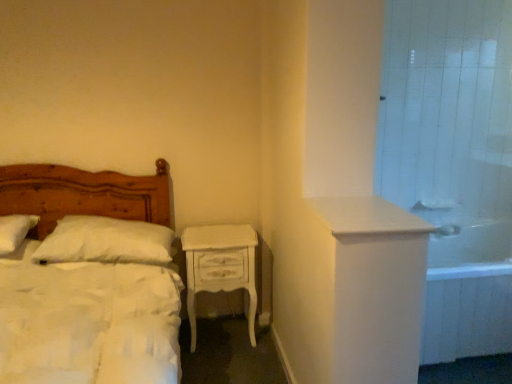
This screenshot has width=512, height=384. Find the location of `white tile shower door at upper right`. white tile shower door at upper right is located at coordinates (453, 162).

Describe the element at coordinates (106, 241) in the screenshot. The height and width of the screenshot is (384, 512). I see `white soft pillow at left, the second pillow viewed from the left` at that location.

In order to face white soft pillow at left, which appears as the 2th pillow when viewed from the right, should I rotate leftwards or rightwards?

To align with it, rotate left about 30.314°.

In order to face white painted wood nightstand at center, should I rotate leftwards or rightwards?

You should rotate left by 4.988 degrees.

Measure the distance between white glossy sink at upper right and camera.

A distance of 2.83 meters exists between white glossy sink at upper right and camera.

At what (x,y) coordinates should I click in order to perform the action: click on white tile shower door at upper right. Please return your answer as a coordinate pair (x, y). Looking at the image, I should click on (453, 162).

Does white soft pillow at left, which appears as the 2th pillow when viewed from the right, have a lesser height compared to white tile shower door at upper right?

Indeed, white soft pillow at left, which appears as the 2th pillow when viewed from the right, has a lesser height compared to white tile shower door at upper right.

Which of these two, white soft pillow at left, which is counted as the first pillow, starting from the left, or white tile shower door at upper right, is bigger?

With larger size is white tile shower door at upper right.

Is white soft pillow at left, the second pillow viewed from the left, located outside wooden bed at left?

Actually, white soft pillow at left, the second pillow viewed from the left, is at least partially inside wooden bed at left.

Which is behind, white soft pillow at left, the 1th pillow when ordered from right to left, or wooden bed at left?

white soft pillow at left, the 1th pillow when ordered from right to left, is more distant.

Considering the positions of points (103, 226) and (89, 263), is point (103, 226) farther from camera compared to point (89, 263)?

Yes, point (103, 226) is behind point (89, 263).

How different are the orientations of white soft pillow at left, the 1th pillow when ordered from right to left, and wooden bed at left in degrees?

The facing directions of white soft pillow at left, the 1th pillow when ordered from right to left, and wooden bed at left are 2.78 degrees apart.

From the image's perspective, is white soft pillow at left, which appears as the 2th pillow when viewed from the right, located beneath wooden bed at left?

Incorrect, from the image's perspective, white soft pillow at left, which appears as the 2th pillow when viewed from the right, is higher than wooden bed at left.

Which object is positioned more to the left, white soft pillow at left, which appears as the 2th pillow when viewed from the right, or wooden bed at left?

Positioned to the left is white soft pillow at left, which appears as the 2th pillow when viewed from the right.

Is there a large distance between white soft pillow at left, which is counted as the first pillow, starting from the left, and wooden bed at left?

white soft pillow at left, which is counted as the first pillow, starting from the left, is near wooden bed at left, not far away.

Between white soft pillow at left, which is counted as the first pillow, starting from the left, and wooden bed at left, which one has smaller size?

white soft pillow at left, which is counted as the first pillow, starting from the left.

Is white tile shower door at upper right positioned far away from white painted wood nightstand at center?

Yes, white tile shower door at upper right is far from white painted wood nightstand at center.

Is white tile shower door at upper right surrounding white painted wood nightstand at center?

Definitely not — white painted wood nightstand at center is not inside white tile shower door at upper right.

From the picture: From the image's perspective, which is above, white tile shower door at upper right or white painted wood nightstand at center?

Answer: white tile shower door at upper right, from the image's perspective.

Looking at the image, does white tile shower door at upper right seem bigger or smaller compared to white painted wood nightstand at center?

Clearly, white tile shower door at upper right is smaller in size than white painted wood nightstand at center.

Is white glossy sink at upper right to the left of white glossy bathtub at right from the viewer's perspective?

Yes.

Does point (415, 205) come closer to viewer compared to point (472, 345)?

No, (415, 205) is further to viewer.

How different are the orientations of white glossy sink at upper right and white glossy bathtub at right in degrees?

white glossy sink at upper right and white glossy bathtub at right are facing 0.000242 degrees away from each other.

At what (x,y) coordinates should I click in order to perform the action: click on sink above the white glossy bathtub at right (from the image's perspective). Please return your answer as a coordinate pair (x, y). The height and width of the screenshot is (384, 512). Looking at the image, I should click on (434, 206).

Considering the relative sizes of wooden bed at left and white soft pillow at left, the 1th pillow when ordered from right to left, in the image provided, is wooden bed at left shorter than white soft pillow at left, the 1th pillow when ordered from right to left,?

In fact, wooden bed at left may be taller than white soft pillow at left, the 1th pillow when ordered from right to left.

Considering the positions of objects wooden bed at left and white soft pillow at left, the 1th pillow when ordered from right to left, in the image provided, who is in front, wooden bed at left or white soft pillow at left, the 1th pillow when ordered from right to left,?

Positioned in front is wooden bed at left.

Is wooden bed at left spatially inside white soft pillow at left, the second pillow viewed from the left, or outside of it?

The correct answer is: outside.

From a real-world perspective, between wooden bed at left and white soft pillow at left, the second pillow viewed from the left, who is vertically higher?

From a 3D spatial view, white soft pillow at left, the second pillow viewed from the left, is above.

Which object is positioned more to the left, white soft pillow at left, which appears as the 2th pillow when viewed from the right, or white glossy sink at upper right?

From the viewer's perspective, white soft pillow at left, which appears as the 2th pillow when viewed from the right, appears more on the left side.

Is white soft pillow at left, which is counted as the first pillow, starting from the left, far away from white glossy sink at upper right?

white soft pillow at left, which is counted as the first pillow, starting from the left, is far away from white glossy sink at upper right.

Is white soft pillow at left, which appears as the 2th pillow when viewed from the right, thinner than white glossy sink at upper right?

In fact, white soft pillow at left, which appears as the 2th pillow when viewed from the right, might be wider than white glossy sink at upper right.

Locate an element on the screen. shower door in front of the white soft pillow at left, which is counted as the first pillow, starting from the left is located at coordinates (453, 162).

From a real-world perspective, which pillow is the 1st one above the wooden bed at left? Please provide its 2D coordinates.

[(106, 241)]

Looking at the image, which one is located closer to white glossy bathtub at right, white soft pillow at left, the second pillow viewed from the left, or white glossy sink at upper right?

The object closer to white glossy bathtub at right is white glossy sink at upper right.

Estimate the real-world distances between objects in this image. Which object is closer to white glossy bathtub at right, white soft pillow at left, the 1th pillow when ordered from right to left, or wooden bed at left?

white soft pillow at left, the 1th pillow when ordered from right to left, is positioned closer to the anchor white glossy bathtub at right.

When comparing their distances from white soft pillow at left, the 1th pillow when ordered from right to left, does white soft pillow at left, which is counted as the first pillow, starting from the left, or wooden bed at left seem closer?

Based on the image, wooden bed at left appears to be nearer to white soft pillow at left, the 1th pillow when ordered from right to left.

When comparing their distances from white tile shower door at upper right, does wooden bed at left or white soft pillow at left, which appears as the 2th pillow when viewed from the right, seem closer?

Among the two, wooden bed at left is located nearer to white tile shower door at upper right.

Based on their spatial positions, is white soft pillow at left, the second pillow viewed from the left, or white tile shower door at upper right closer to white glossy sink at upper right?

white tile shower door at upper right.

Estimate the real-world distances between objects in this image. Which object is closer to wooden bed at left, white soft pillow at left, the 1th pillow when ordered from right to left, or white glossy sink at upper right?

white soft pillow at left, the 1th pillow when ordered from right to left, lies closer to wooden bed at left than the other object.

Based on their spatial positions, is white glossy sink at upper right or white soft pillow at left, the 1th pillow when ordered from right to left, further from white soft pillow at left, which is counted as the first pillow, starting from the left?

white glossy sink at upper right is further to white soft pillow at left, which is counted as the first pillow, starting from the left.

From the image, which object appears to be nearer to white glossy bathtub at right, white soft pillow at left, which appears as the 2th pillow when viewed from the right, or white soft pillow at left, the 1th pillow when ordered from right to left?

white soft pillow at left, the 1th pillow when ordered from right to left, lies closer to white glossy bathtub at right than the other object.

This screenshot has height=384, width=512. What are the coordinates of `nightstand between white soft pillow at left, the 1th pillow when ordered from right to left, and white glossy bathtub at right, in the horizontal direction` in the screenshot? It's located at (220, 267).

Identify the location of pillow between white soft pillow at left, which is counted as the first pillow, starting from the left, and white tile shower door at upper right. (106, 241).

At what (x,y) coordinates should I click in order to perform the action: click on nightstand between white soft pillow at left, the 1th pillow when ordered from right to left, and white glossy sink at upper right, in the horizontal direction. Please return your answer as a coordinate pair (x, y). Looking at the image, I should click on (220, 267).

Where is `nightstand located between white soft pillow at left, the 1th pillow when ordered from right to left, and white tile shower door at upper right in the left-right direction`? The height and width of the screenshot is (384, 512). nightstand located between white soft pillow at left, the 1th pillow when ordered from right to left, and white tile shower door at upper right in the left-right direction is located at coordinates (220, 267).